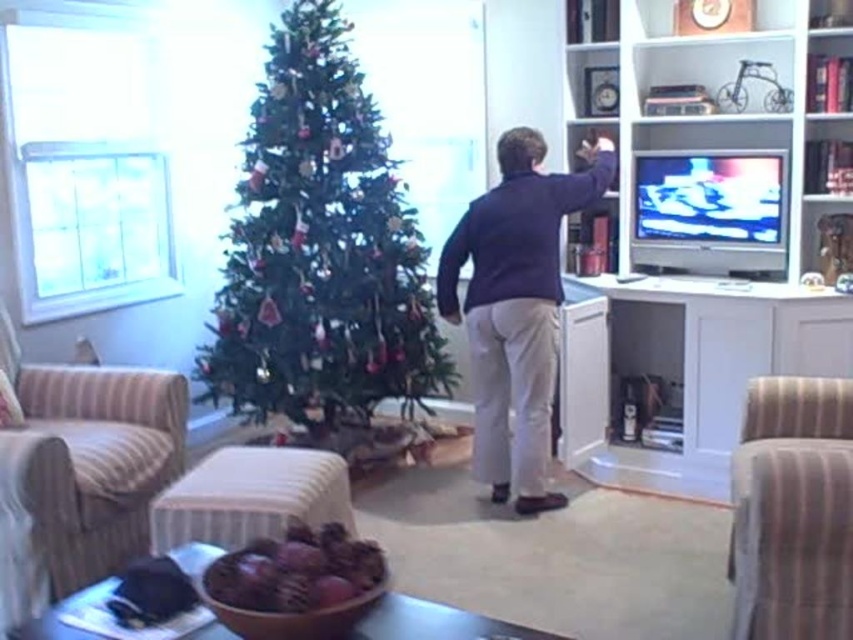
Question: Which point appears closest to the camera in this image?

Choices:
 (A) (838, 593)
 (B) (144, 385)

Answer: (A)

Question: Does dark blue sweater at center have a larger size compared to striped fabric armchair at right?

Choices:
 (A) yes
 (B) no

Answer: (A)

Question: Which is farther from the green matte christmas tree at center?

Choices:
 (A) dark blue sweater at center
 (B) beige striped armchair at left

Answer: (B)

Question: Does beige striped armchair at left appear over striped fabric armchair at right?

Choices:
 (A) no
 (B) yes

Answer: (B)

Question: Which object is farther from the camera taking this photo?

Choices:
 (A) striped fabric armchair at right
 (B) green matte christmas tree at center
 (C) beige striped armchair at left

Answer: (B)

Question: Can you confirm if green matte christmas tree at center is positioned below striped fabric armchair at right?

Choices:
 (A) no
 (B) yes

Answer: (A)